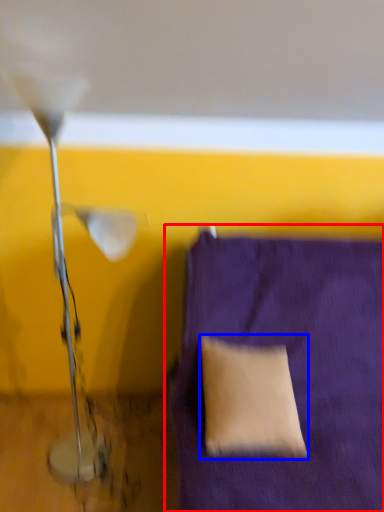
Question: Which object appears closest to the camera in this image, furniture (highlighted by a red box) or pillow (highlighted by a blue box)?

Choices:
 (A) furniture
 (B) pillow

Answer: (A)